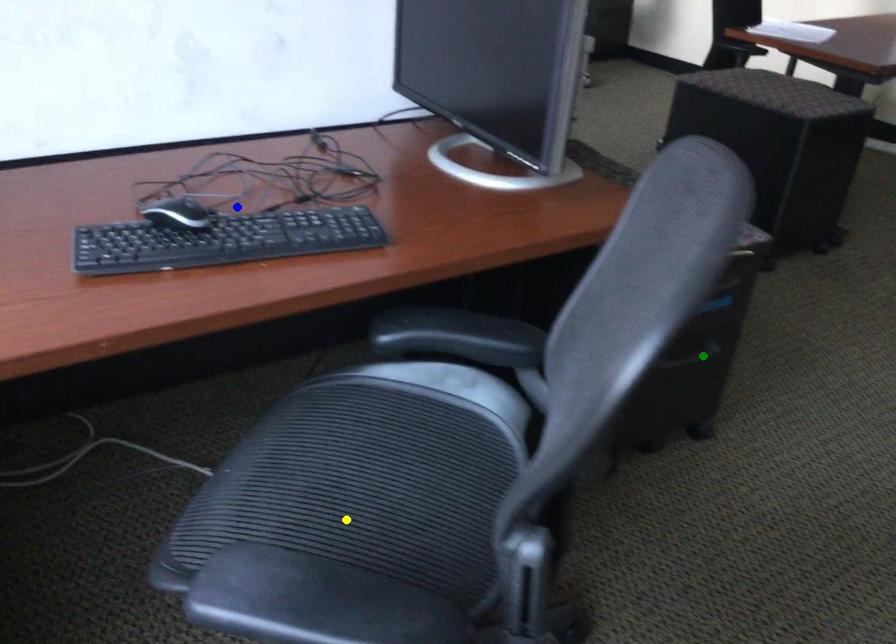
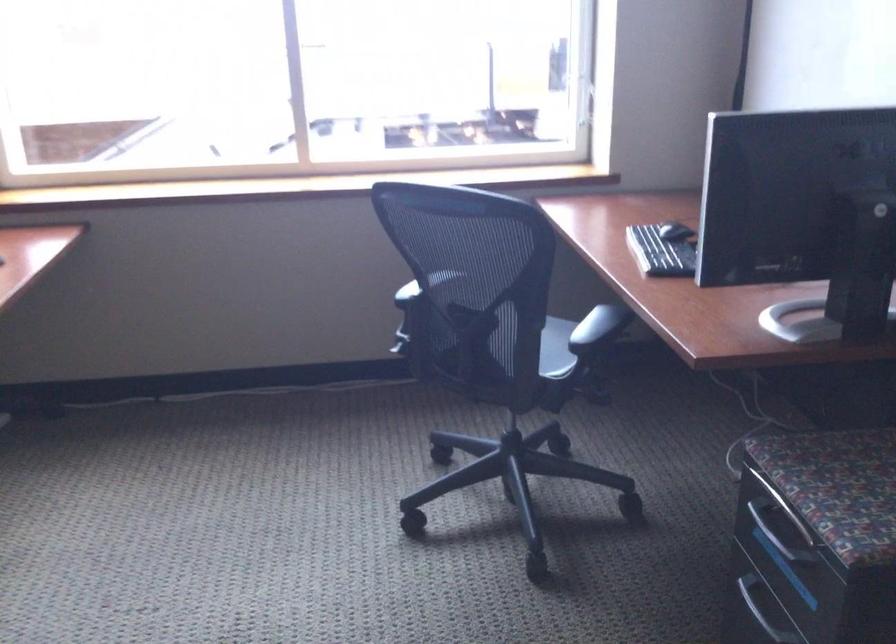
I am providing you with two images of the same scene from different viewpoints. Three points are marked in image1. Which point corresponds to a part or object that is occluded in image2?In image1, three points are marked. Which of them correspond to a part or object that is occluded in image2?Among the three points shown in image1, which one corresponds to a part or object that is no longer visible due to occlusion in image2?

Invisible in image2: yellow point.